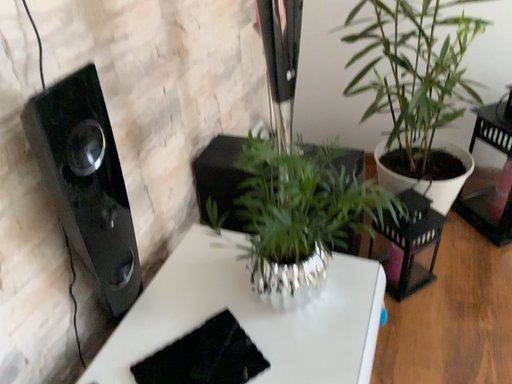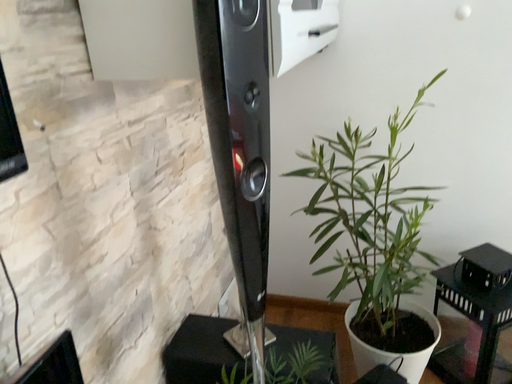
Question: Which way did the camera rotate in the video?

Choices:
 (A) rotated downward
 (B) rotated upward

Answer: (B)